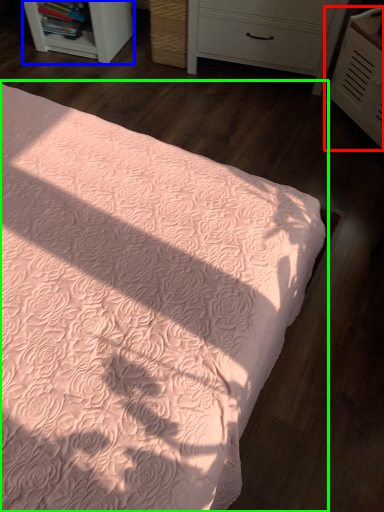
Question: Which object is the farthest from chest of drawers (highlighted by a red box)? Choose among these: shelf (highlighted by a blue box) or bed (highlighted by a green box).

Choices:
 (A) shelf
 (B) bed

Answer: (A)